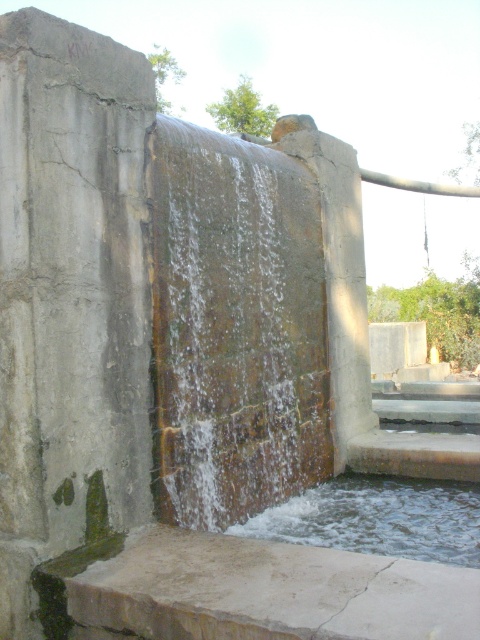
Question: Which object is closer to the camera taking this photo?

Choices:
 (A) smooth concrete slab at lower center
 (B) clear water at bottom

Answer: (A)

Question: From the image, what is the correct spatial relationship of smooth concrete slab at lower center in relation to clear water at bottom?

Choices:
 (A) above
 (B) below

Answer: (A)

Question: Is smooth concrete slab at lower center in front of clear water at bottom?

Choices:
 (A) yes
 (B) no

Answer: (A)

Question: Is smooth concrete slab at lower center closer to the viewer compared to clear water at bottom?

Choices:
 (A) no
 (B) yes

Answer: (B)

Question: Which point appears closest to the camera in this image?

Choices:
 (A) (266, 579)
 (B) (466, 493)

Answer: (A)